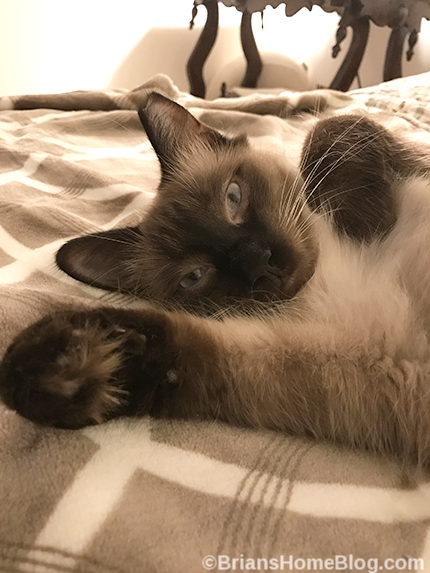
This screenshot has width=430, height=573. I want to click on white stripes on blanket, so click(99, 486), click(35, 251), click(19, 176).